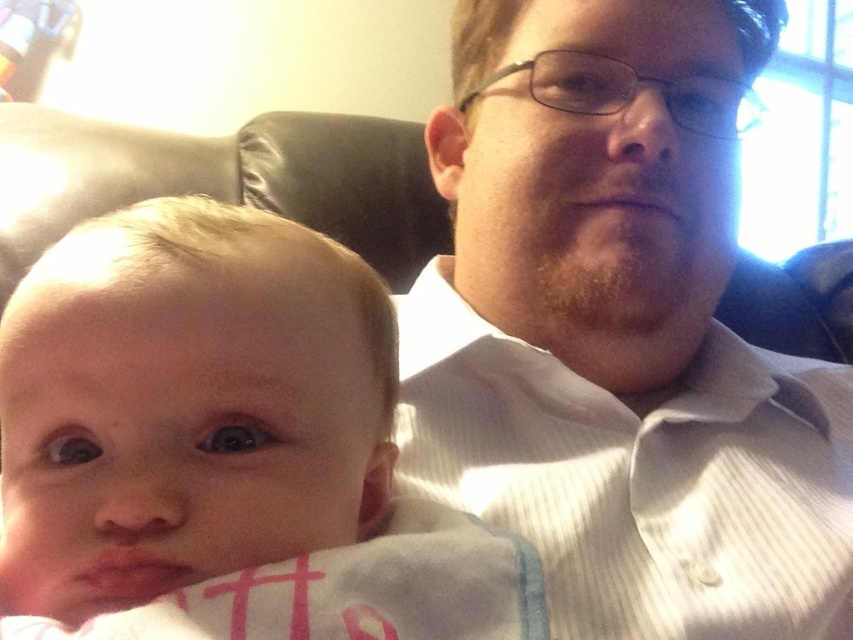
Image resolution: width=853 pixels, height=640 pixels. Identify the location of white striped shirt at upper right. (618, 333).

Does white striped shirt at upper right appear on the left side of smooth skin baby at center?

Incorrect, white striped shirt at upper right is not on the left side of smooth skin baby at center.

Between point (703, 609) and point (277, 476), which one is positioned in front?

Positioned in front is point (277, 476).

This screenshot has height=640, width=853. I want to click on white striped shirt at upper right, so click(x=618, y=333).